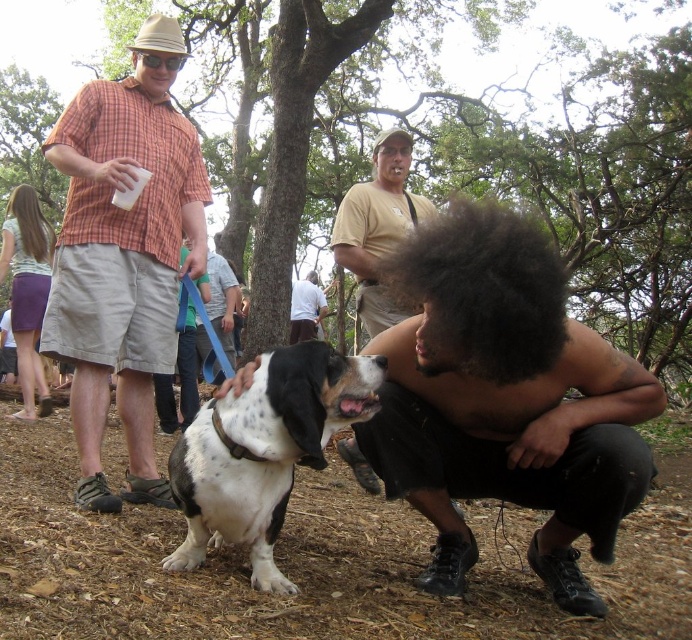
Question: Which of the following is the closest to the observer?

Choices:
 (A) plaid shirt at left
 (B) tan cotton shirt at center

Answer: (A)

Question: Is shiny black hair at center further to camera compared to tan cotton shirt at center?

Choices:
 (A) yes
 (B) no

Answer: (B)

Question: Is plaid shirt at left to the right of white shirt at center from the viewer's perspective?

Choices:
 (A) no
 (B) yes

Answer: (A)

Question: Does shiny black hair at center have a smaller size compared to dark curly hair at center?

Choices:
 (A) yes
 (B) no

Answer: (B)

Question: Which object appears farthest from the camera in this image?

Choices:
 (A) tan cotton shirt at center
 (B) black curly hair at center
 (C) white-spotted fur dog at center

Answer: (B)

Question: Which point appears farthest from the camera in this image?

Choices:
 (A) (655, 387)
 (B) (235, 429)
 (C) (453, 228)
 (D) (71, 104)

Answer: (D)